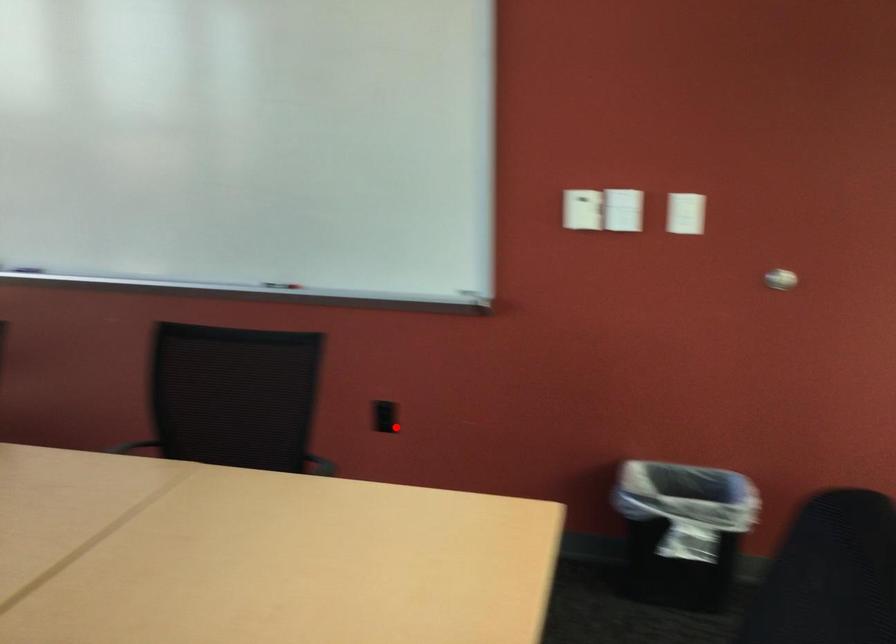
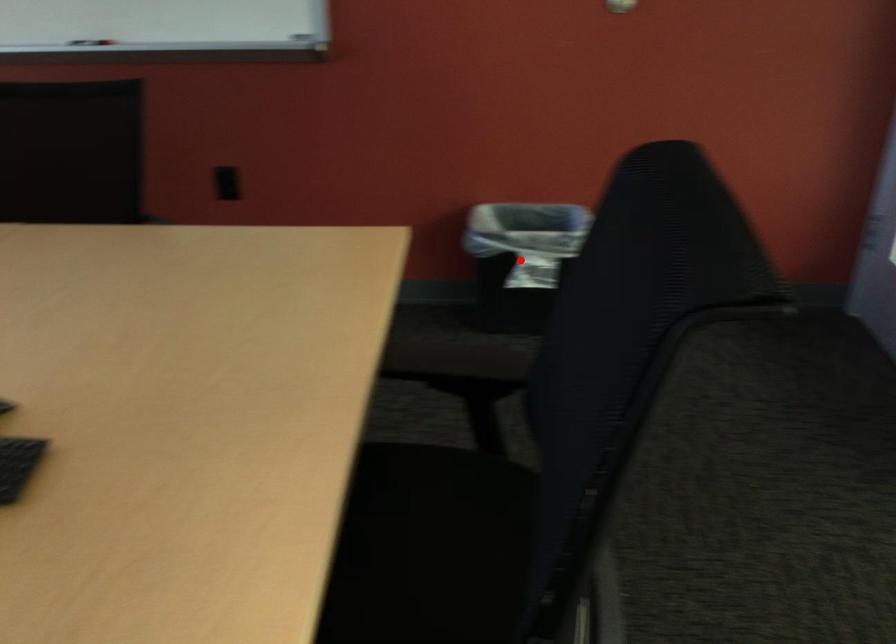
I am providing you with two images of the same scene from different viewpoints. A red point is marked on the first image and another point is marked on the second image. Are the points marked in image1 and image2 representing the same 3D position?

No